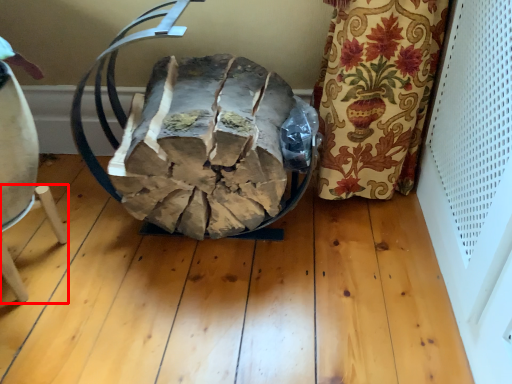
Question: From the image's perspective, where is furniture (annotated by the red box) located in relation to bean bag chair in the image?

Choices:
 (A) above
 (B) below

Answer: (B)